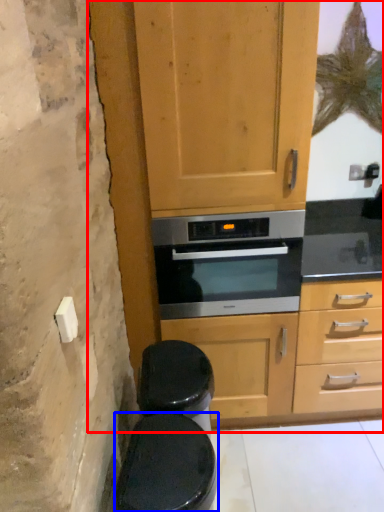
Question: Which of the following is the closest to the observer, dresser (highlighted by a red box) or toilet bowl (highlighted by a blue box)?

Choices:
 (A) dresser
 (B) toilet bowl

Answer: (B)